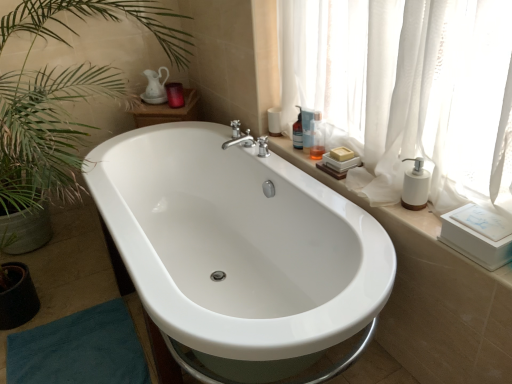
Where is `free space above white ceramic window sill at upper right (from a real-world perspective)`? free space above white ceramic window sill at upper right (from a real-world perspective) is located at coordinates coord(368,192).